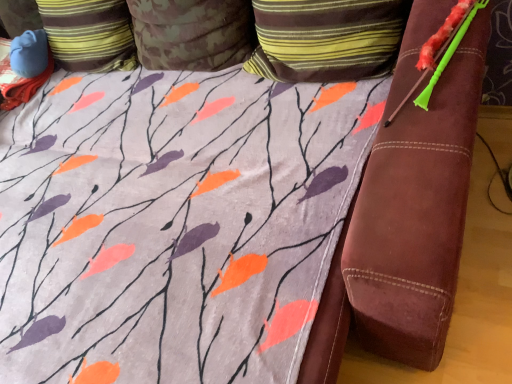
Question: In the image, is camouflage fabric pillow at upper center, which is counted as the second pillow, starting from the right, on the left side or the right side of camouflage fabric pillow at upper left, the third pillow in the right-to-left sequence?

Choices:
 (A) right
 (B) left

Answer: (A)

Question: Considering the positions of point (159, 29) and point (99, 1), is point (159, 29) closer or farther from the camera than point (99, 1)?

Choices:
 (A) farther
 (B) closer

Answer: (B)

Question: Which is nearer to the camouflage fabric pillow at upper left, the third pillow in the right-to-left sequence?

Choices:
 (A) camouflage fabric pillow at upper center, which is counted as the second pillow, starting from the right
 (B) striped fabric pillow at upper center, which appears as the third pillow when viewed from the left

Answer: (A)

Question: Which object is the farthest from the camouflage fabric pillow at upper center, which is counted as the second pillow, starting from the right?

Choices:
 (A) camouflage fabric pillow at upper left, the third pillow in the right-to-left sequence
 (B) striped fabric pillow at upper center, which appears as the third pillow when viewed from the left

Answer: (B)